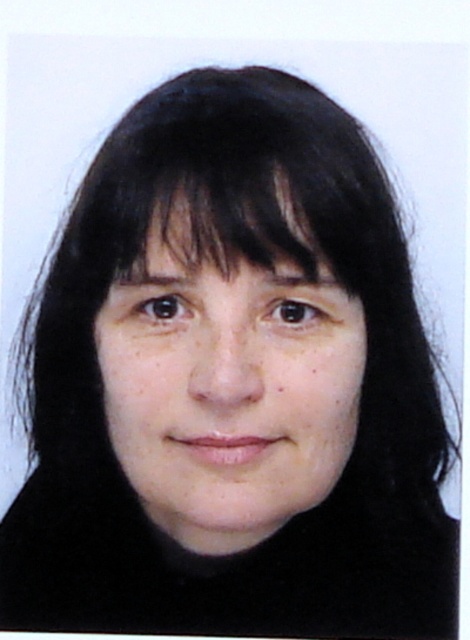
Based on the photo, based on the scene description, can you determine which object is wider between the smooth skin face at center and the black matte hair at upper center?

The smooth skin face at center is wider than the black matte hair at upper center according to the description.

You are an artist sketching the portrait and want to add a highlight on the point that is closer to the viewer. Which point should you choose between point (195,428) and point (307,253)?

Point (307,253) is closer to the viewer than point (195,428), so you should choose point (307,253) to add the highlight.

Based on the description, where is the smooth skin face at center located in the image?

The smooth skin face at center is located at the 2D coordinates point of (227, 384).